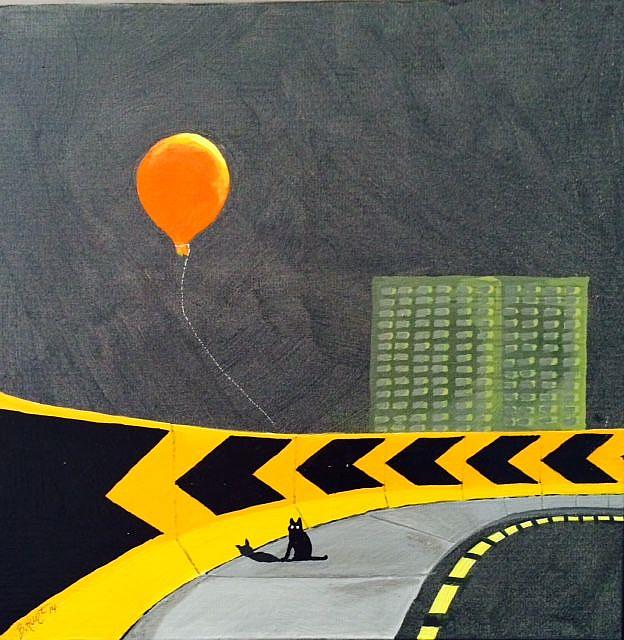
I want to click on canvas, so click(343, 106).